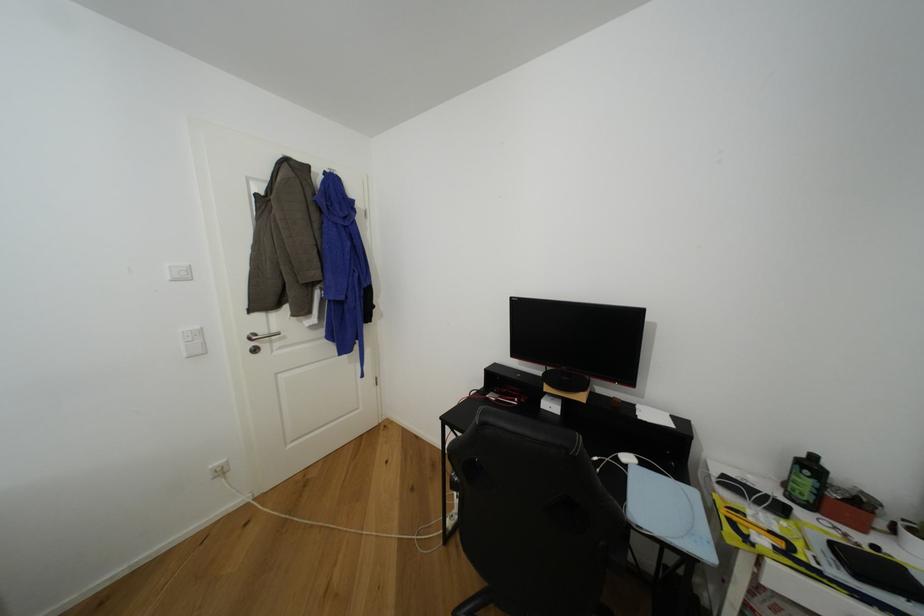
Find where to push the silver door handle. Please return your answer as a coordinate pair (x, y).

(259, 339)